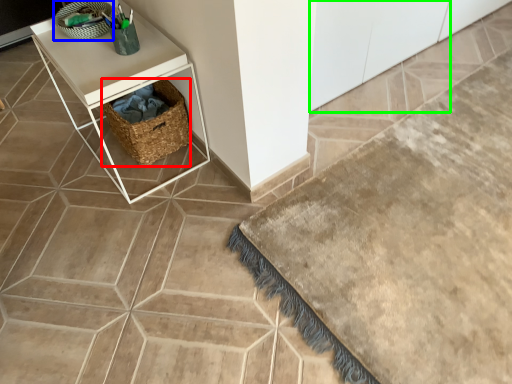
Question: Which object is positioned farthest from basket (highlighted by a red box)? Select from basket (highlighted by a blue box) and cabinetry (highlighted by a green box).

Choices:
 (A) basket
 (B) cabinetry

Answer: (B)